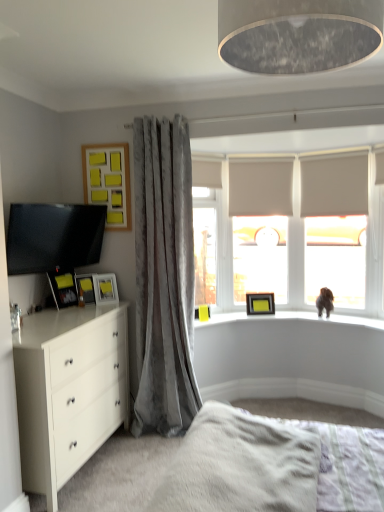
Question: Is white fluffy bed at lower center spatially inside white glossy chest of drawers at lower left, or outside of it?

Choices:
 (A) inside
 (B) outside

Answer: (B)

Question: From a real-world perspective, relative to white glossy chest of drawers at lower left, is white fluffy bed at lower center vertically above or below?

Choices:
 (A) above
 (B) below

Answer: (A)

Question: Which is nearer to the white glossy chest of drawers at lower left?

Choices:
 (A) matte gray lampshade at upper center
 (B) matte yellow picture frame at upper center, which is the first picture frame in back-to-front order
 (C) matte yellow picture frame at left, marked as the 2th picture frame in a front-to-back arrangement
 (D) white fluffy bed at lower center
 (E) matte black tv at left

Answer: (E)

Question: Considering the real-world distances, which object is farthest from the yellow matte picture frame at left, which is counted as the third picture frame, starting from the left?

Choices:
 (A) matte black tv at left
 (B) velvet gray curtain at left
 (C) matte black picture frame at left, the 5th picture frame viewed from the right
 (D) matte yellow picture frame at left, which is the fourth picture frame in top-to-bottom order
 (E) white glossy chest of drawers at lower left

Answer: (E)